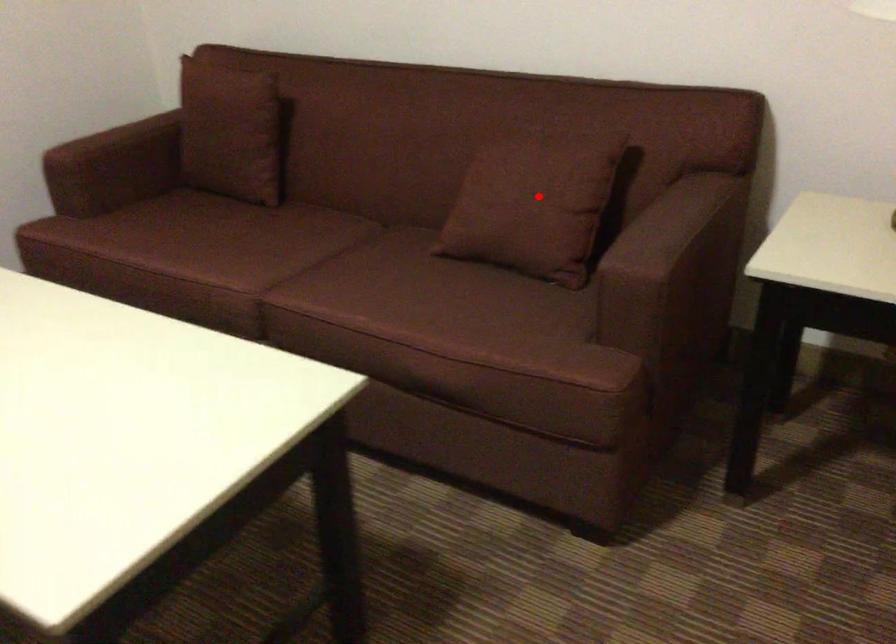
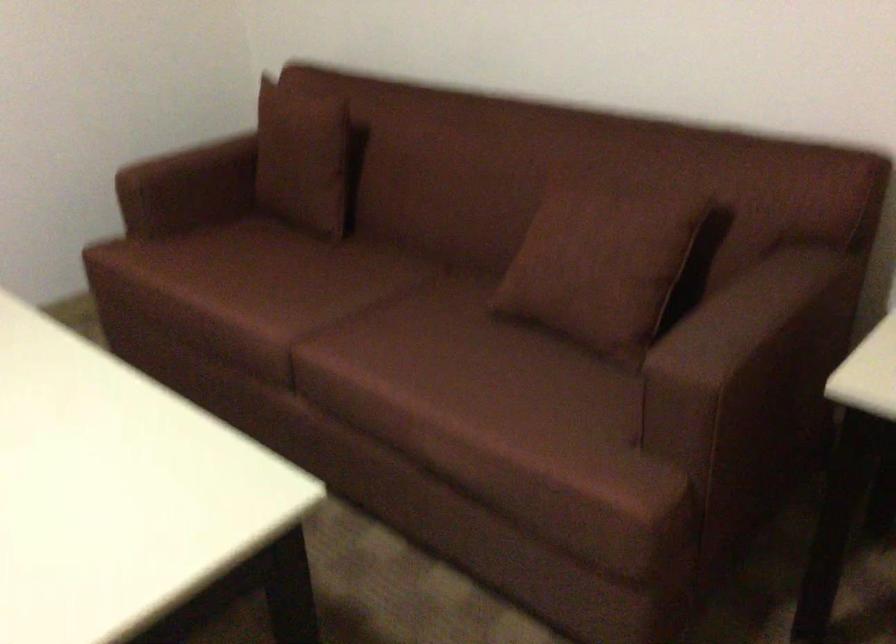
Question: I am providing you with two images of the same scene from different viewpoints. A red point is shown in image1. For the corresponding object point in image2, is it positioned nearer or farther from the camera?

Choices:
 (A) Nearer
 (B) Farther

Answer: (A)